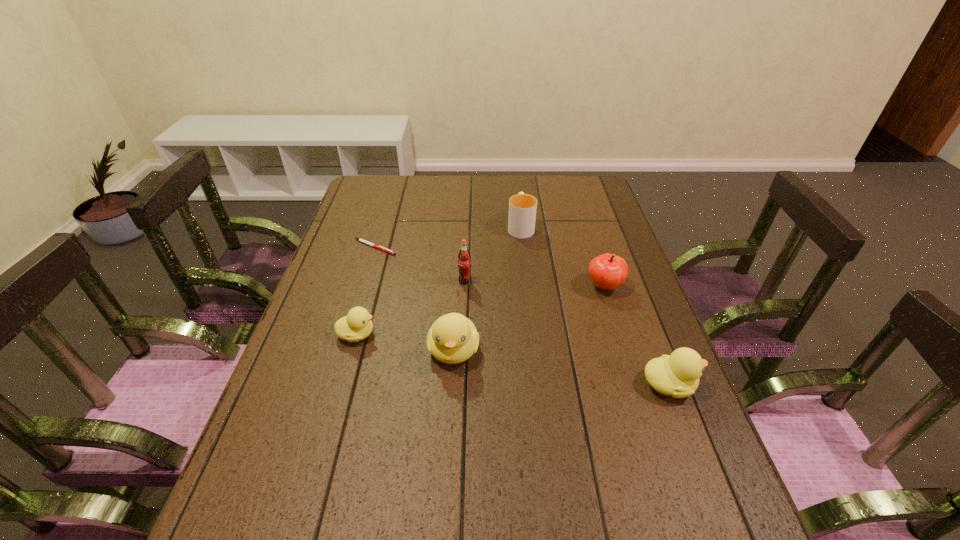
Identify the location of the leftmost duckling. (357, 325).

Where is `the shortest duckling`? This screenshot has height=540, width=960. the shortest duckling is located at coordinates (357, 325).

You are a GUI agent. You are given a task and a screenshot of the screen. Output one action in this format:
    pyautogui.click(x=<x>, y=<y>)
    Task: Click on the second duckling from right to left
    This screenshot has width=960, height=540.
    Given the screenshot: What is the action you would take?
    pyautogui.click(x=453, y=338)

Where is `the rightmost duckling`? Image resolution: width=960 pixels, height=540 pixels. the rightmost duckling is located at coordinates (677, 375).

You are a GUI agent. You are given a task and a screenshot of the screen. Output one action in this format:
    pyautogui.click(x=<x>, y=<y>)
    Task: Click on the farthest object
    This screenshot has height=540, width=960.
    Given the screenshot: What is the action you would take?
    pyautogui.click(x=522, y=207)

Where is `cup`? The image size is (960, 540). cup is located at coordinates (522, 207).

Where is `pen`? pen is located at coordinates (359, 239).

Find the location of a particular element. the shortest object is located at coordinates (359, 239).

Locate an element on the screen. apple is located at coordinates [608, 271].

What are the coordinates of `soda bottle` in the screenshot? It's located at (464, 258).